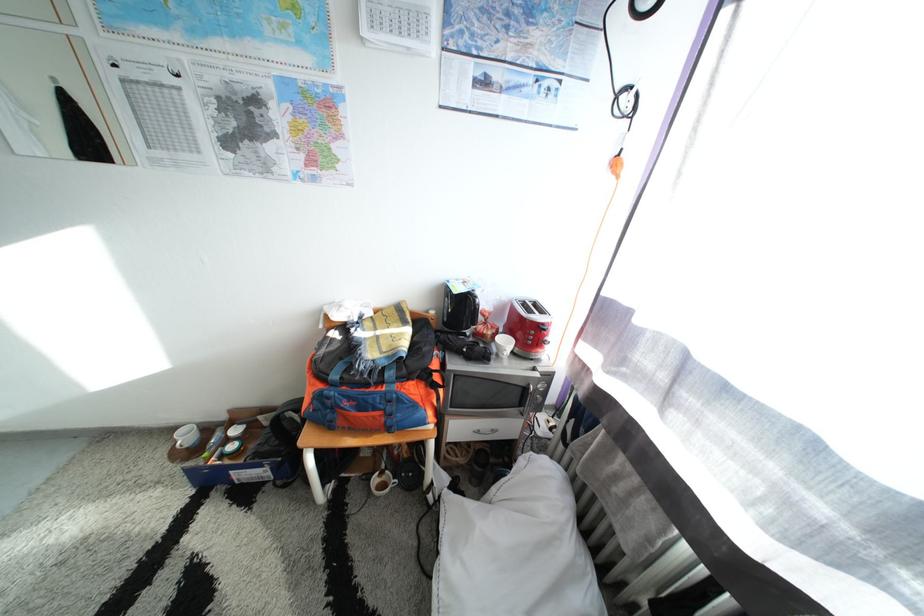
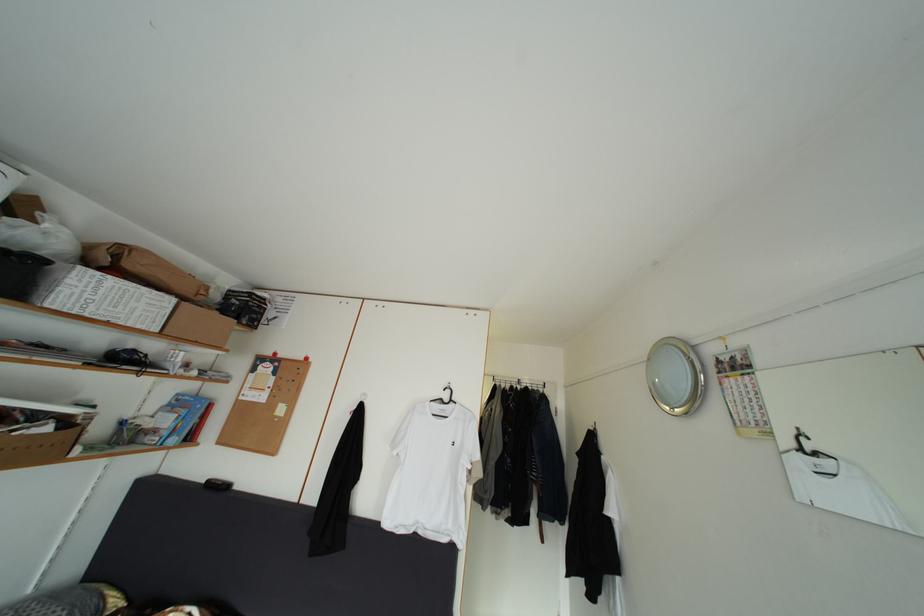
The first image is from the beginning of the video and the second image is from the end. How did the camera likely rotate when shooting the video?

The camera's rotation is toward left-up.